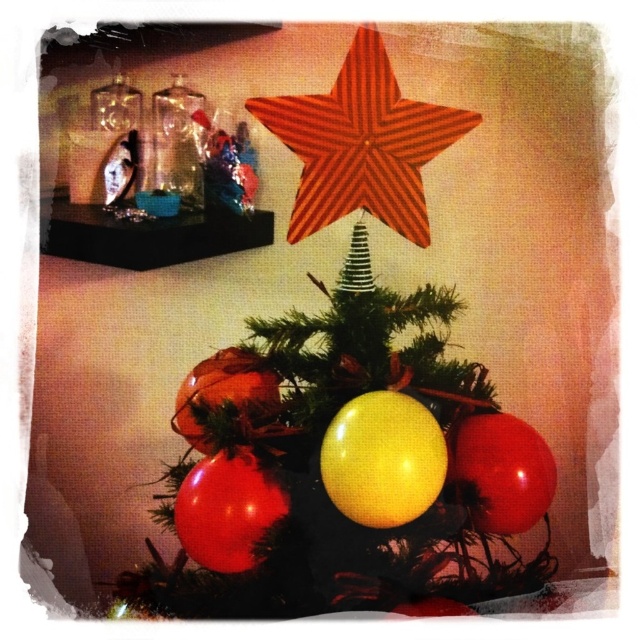
You are standing in front of the Christmas tree and want to place a small gift exactly at the point specified by the coordinates point [362,144]. Given the description of the tree and its decorations, where will this gift be placed?

The point [362,144] is located on the red striped star at upper center of the Christmas tree, so placing the gift there would position it directly on the star at the top of the tree.